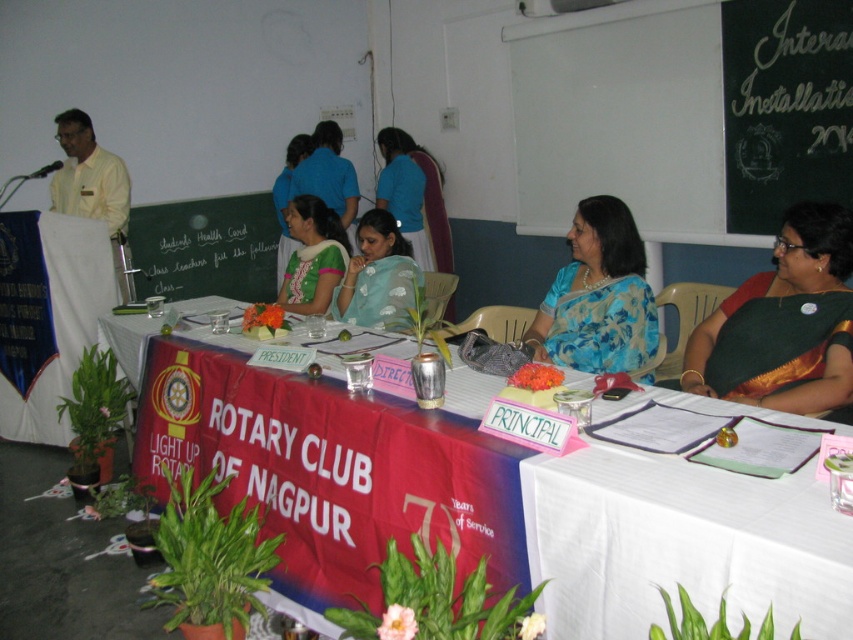
Does green chalkboard at upper center have a greater width compared to light blue saree at center?

Indeed, green chalkboard at upper center has a greater width compared to light blue saree at center.

Who is positioned more to the right, green chalkboard at upper center or light blue saree at center?

green chalkboard at upper center

Is point (727, 33) positioned before point (379, 262)?

That is False.

Where is `green chalkboard at upper center`? This screenshot has height=640, width=853. green chalkboard at upper center is located at coordinates (683, 112).

Who is lower down, green chalkboard at upper center or green embroidered blouse at center?

green embroidered blouse at center is lower down.

Who is more distant from viewer, (801, 120) or (343, 252)?

Point (343, 252)

Identify the location of green chalkboard at upper center. This screenshot has width=853, height=640. (683, 112).

In order to click on black chalkboard at center in this screenshot , I will do `click(206, 248)`.

Identify the location of black chalkboard at center. The image size is (853, 640). (206, 248).